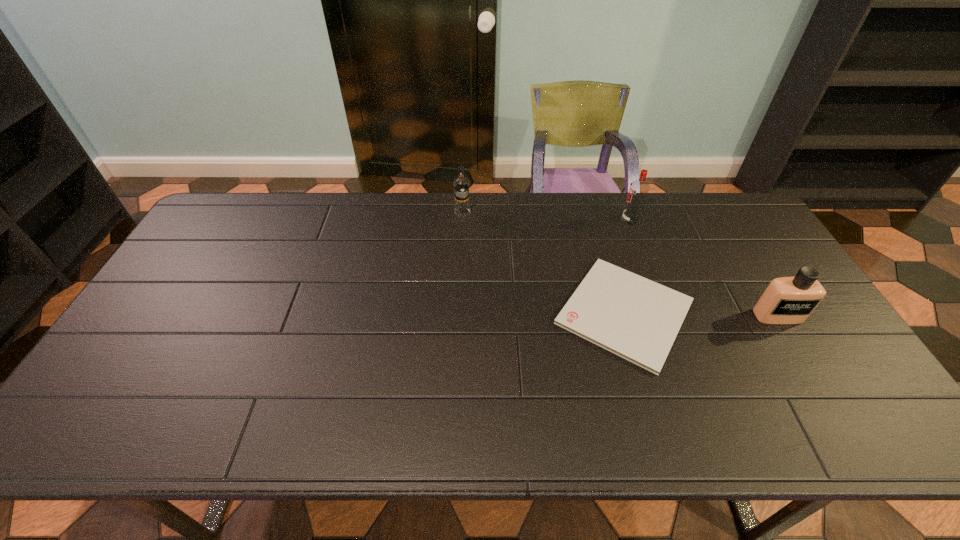
This screenshot has height=540, width=960. I want to click on unoccupied area between the clipboard and the rightmost object, so click(701, 314).

At what (x,y) coordinates should I click in order to perform the action: click on vacant point located between the rightmost object and the left vodka. Please return your answer as a coordinate pair (x, y). Looking at the image, I should click on (620, 264).

Identify the location of free space between the shortest object and the rightmost object. The width and height of the screenshot is (960, 540). (701, 314).

Identify the location of vacant space in between the perfume and the clipboard. (701, 314).

I want to click on vacant space in between the perfume and the clipboard, so click(x=701, y=314).

At what (x,y) coordinates should I click in order to perform the action: click on free space between the shortest object and the right vodka. Please return your answer as a coordinate pair (x, y). Looking at the image, I should click on (627, 266).

Find the location of a particular element. The width and height of the screenshot is (960, 540). the third closest object relative to the left vodka is located at coordinates (787, 300).

Locate which object is the third closest to the perfume. Please provide its 2D coordinates. Your answer should be formatted as a tuple, i.e. [(x, y)], where the tuple contains the x and y coordinates of a point satisfying the conditions above.

[(461, 184)]